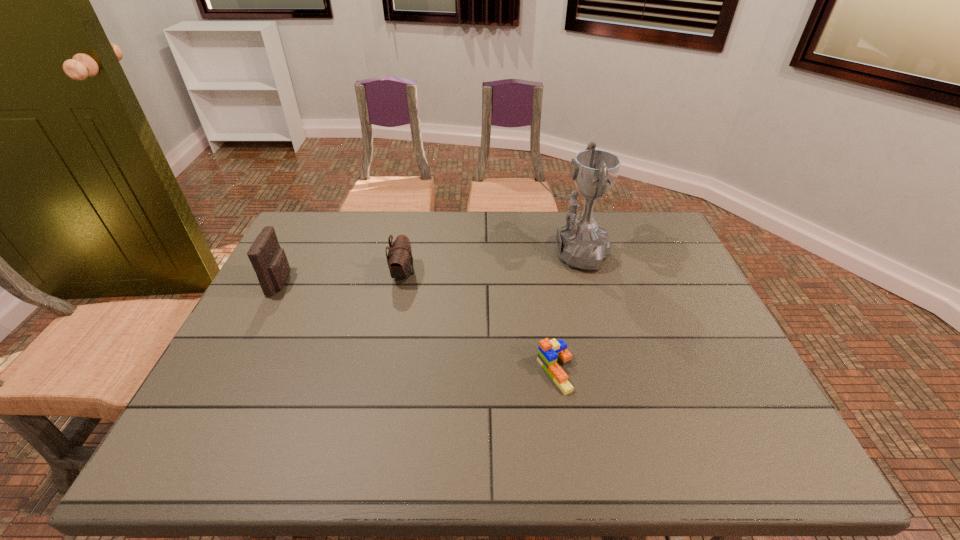
You are a GUI agent. You are given a task and a screenshot of the screen. Output one action in this format:
    pyautogui.click(x=<x>, y=<y>)
    Task: Click on the vacant region at the near right corner of the desktop
    
    Given the screenshot: What is the action you would take?
    pyautogui.click(x=730, y=460)

Identify the location of free space between the Lego and the taller pouch. (419, 327).

In order to click on free spot between the tallest object and the shorter pouch in this screenshot , I will do `click(487, 264)`.

Where is `empty space that is in between the third object from right to left and the award`? Image resolution: width=960 pixels, height=540 pixels. empty space that is in between the third object from right to left and the award is located at coordinates (x=487, y=264).

Where is `vacant space in between the tallest object and the taller pouch`? vacant space in between the tallest object and the taller pouch is located at coordinates pos(426,268).

Where is `empty space that is in between the taller pouch and the shorter pouch`? This screenshot has width=960, height=540. empty space that is in between the taller pouch and the shorter pouch is located at coordinates (342, 278).

This screenshot has width=960, height=540. In order to click on blank region between the second tallest object and the tallest object in this screenshot , I will do `click(426, 268)`.

In order to click on free spot between the third tallest object and the third shortest object in this screenshot , I will do click(x=342, y=278).

Where is `vacant space that is in between the second shortest object and the Lego`? vacant space that is in between the second shortest object and the Lego is located at coordinates (479, 323).

You are a GUI agent. You are given a task and a screenshot of the screen. Output one action in this format:
    pyautogui.click(x=<x>, y=<y>)
    Task: Click on the empty location between the shorter pouch and the tallest object
    The width and height of the screenshot is (960, 540).
    Given the screenshot: What is the action you would take?
    pyautogui.click(x=487, y=264)